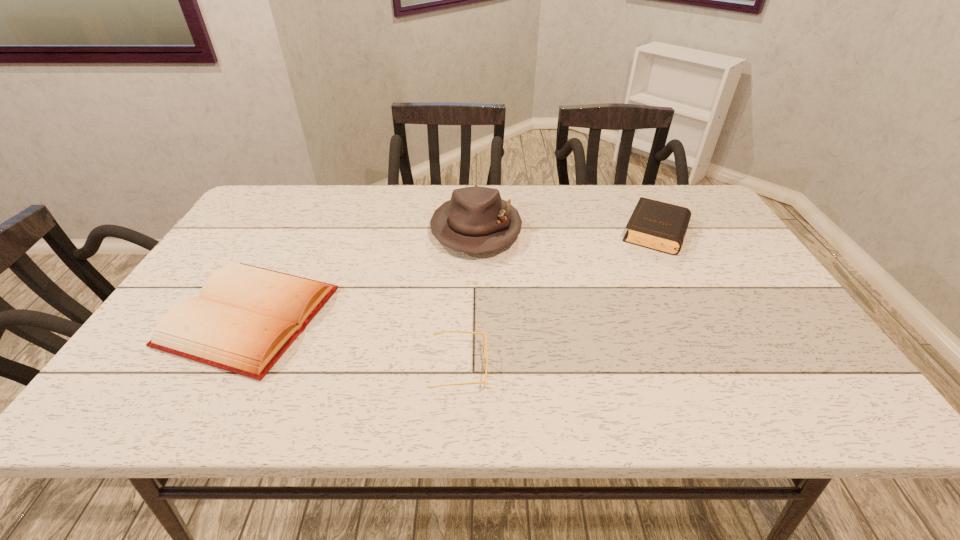
You are a GUI agent. You are given a task and a screenshot of the screen. Output one action in this format:
    pyautogui.click(x=<x>, y=<y>)
    Task: Click on the vacant area that lies between the farther Bible and the spectacles
    
    Given the screenshot: What is the action you would take?
    pyautogui.click(x=558, y=300)

The width and height of the screenshot is (960, 540). What are the coordinates of `vacant space in between the nearer Bible and the hat` in the screenshot? It's located at (363, 273).

Where is `free space that is in between the left Bible and the spectacles`? free space that is in between the left Bible and the spectacles is located at coordinates (354, 342).

Locate which object is the second closest to the right Bible. Please provide its 2D coordinates. Your answer should be formatted as a tuple, i.e. [(x, y)], where the tuple contains the x and y coordinates of a point satisfying the conditions above.

[(484, 337)]

Locate an element on the screen. object that is the third closest to the spectacles is located at coordinates (660, 226).

Locate an element on the screen. The image size is (960, 540). vacant space that satisfies the following two spatial constraints: 1. on the decorative side of the hat; 2. in front of the lenses of the spectacles is located at coordinates (474, 368).

The height and width of the screenshot is (540, 960). I want to click on vacant region that satisfies the following two spatial constraints: 1. on the decorative side of the right Bible; 2. on the right side of the tallest object, so click(x=476, y=232).

What are the coordinates of `vacant space that satisfies the following two spatial constraints: 1. on the decorative side of the hat; 2. in front of the lenses of the spectacles` in the screenshot? It's located at (474, 368).